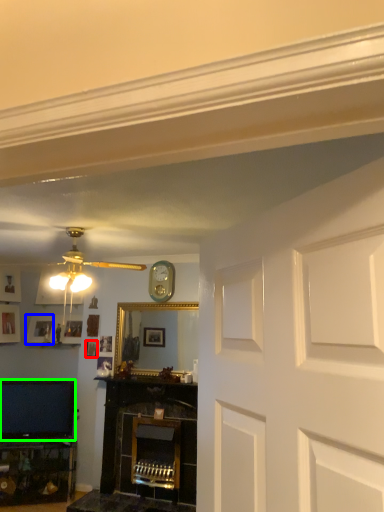
Question: Which object is positioned farthest from picture frame (highlighted by a red box)? Select from picture frame (highlighted by a blue box) and television (highlighted by a green box).

Choices:
 (A) picture frame
 (B) television

Answer: (B)